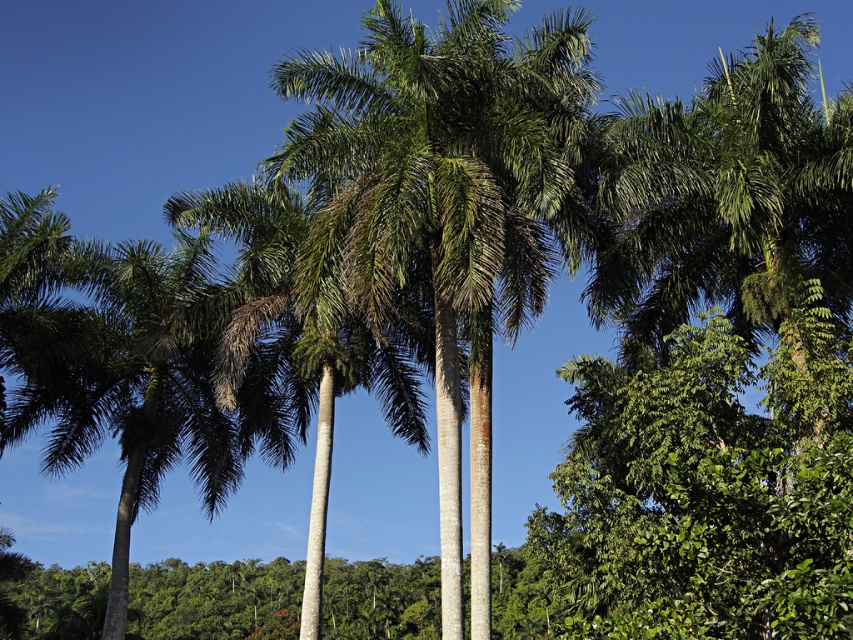
Question: Is green leafy palm at center to the right of green leafy palm tree at left from the viewer's perspective?

Choices:
 (A) yes
 (B) no

Answer: (A)

Question: Does green leafy palm at center have a lesser width compared to green leafy palm tree at center?

Choices:
 (A) no
 (B) yes

Answer: (A)

Question: Is green leafy palm tree at left positioned before green leafy palm tree at center?

Choices:
 (A) yes
 (B) no

Answer: (B)

Question: Which object is the farthest from the green leafy palm tree at center?

Choices:
 (A) green leafy palm at center
 (B) green leafy palm tree at left

Answer: (A)

Question: Which object appears farthest from the camera in this image?

Choices:
 (A) green leafy palm tree at center
 (B) green leafy palm tree at left

Answer: (B)

Question: Which object is closer to the camera taking this photo?

Choices:
 (A) green leafy palm at center
 (B) green leafy palm tree at center
 (C) green leafy palm tree at left

Answer: (A)